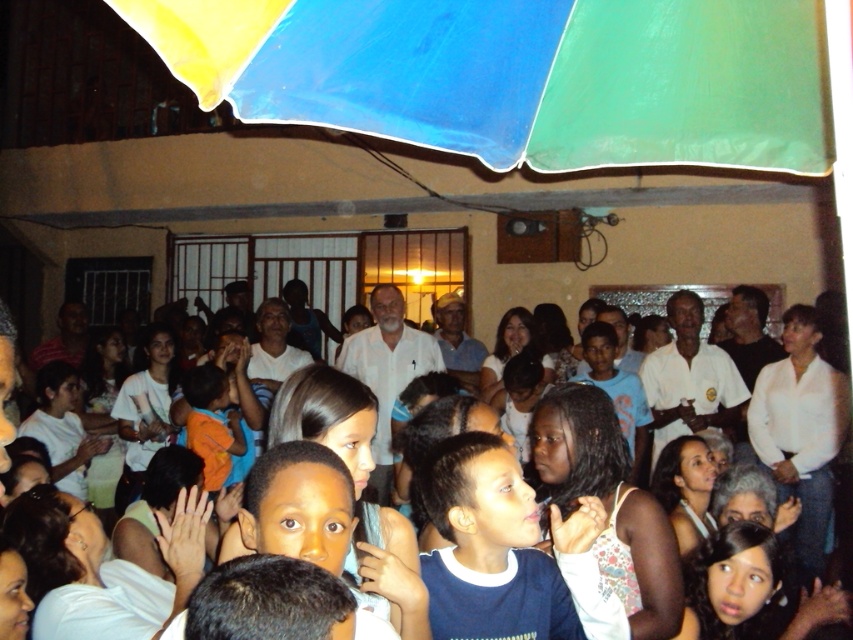
Question: Among these objects, which one is farthest from the camera?

Choices:
 (A) polyester umbrella at upper center
 (B) orange cotton shirt at center
 (C) white cotton crowd at center

Answer: (C)

Question: Is white cotton crowd at center wider than orange cotton shirt at center?

Choices:
 (A) no
 (B) yes

Answer: (A)

Question: Which object is closer to the camera taking this photo?

Choices:
 (A) orange cotton shirt at center
 (B) white cotton crowd at center

Answer: (A)

Question: Can you confirm if polyester umbrella at upper center is wider than white cotton crowd at center?

Choices:
 (A) no
 (B) yes

Answer: (B)

Question: Which point is farther to the camera?

Choices:
 (A) (787, 337)
 (B) (218, 346)

Answer: (B)

Question: Can you confirm if polyester umbrella at upper center is positioned below white cotton crowd at center?

Choices:
 (A) yes
 (B) no

Answer: (B)